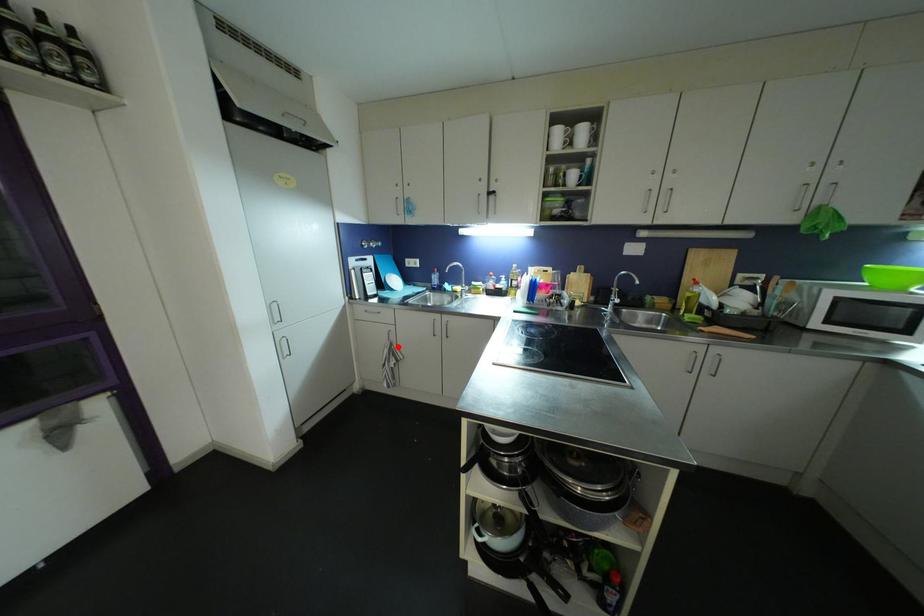
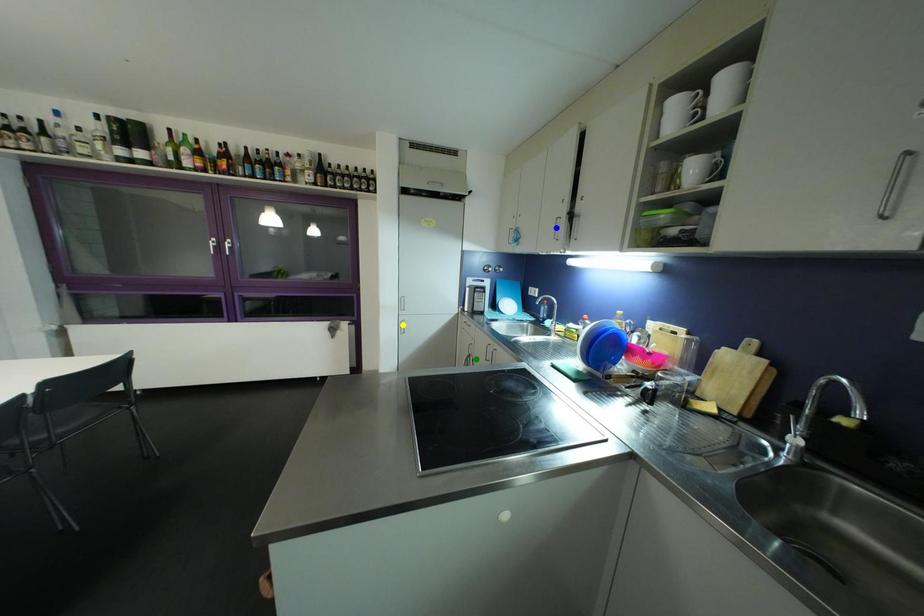
Question: I am providing you with two images of the same scene from different viewpoints. A red point is marked on the first image. You are given multiple points on the second image. Which spot in image 2 lines up with the point in image 1?

Choices:
 (A) blue point
 (B) green point
 (C) yellow point

Answer: (B)